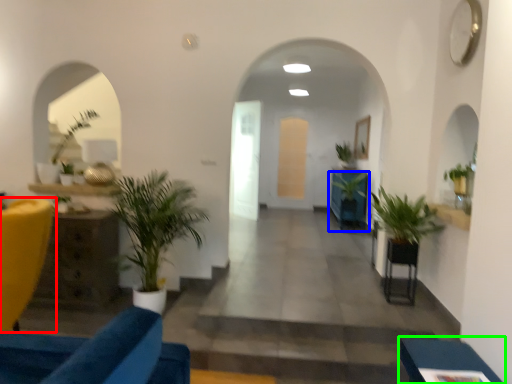
Question: Based on their relative distances, which object is nearer to furniture (highlighted by a red box)? Choose from houseplant (highlighted by a blue box) and furniture (highlighted by a green box).

Choices:
 (A) houseplant
 (B) furniture

Answer: (B)